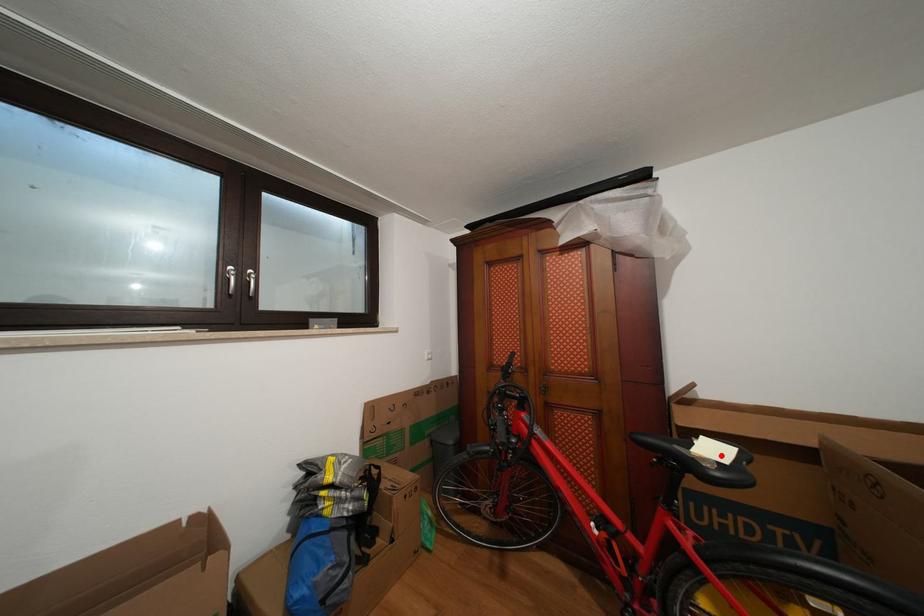
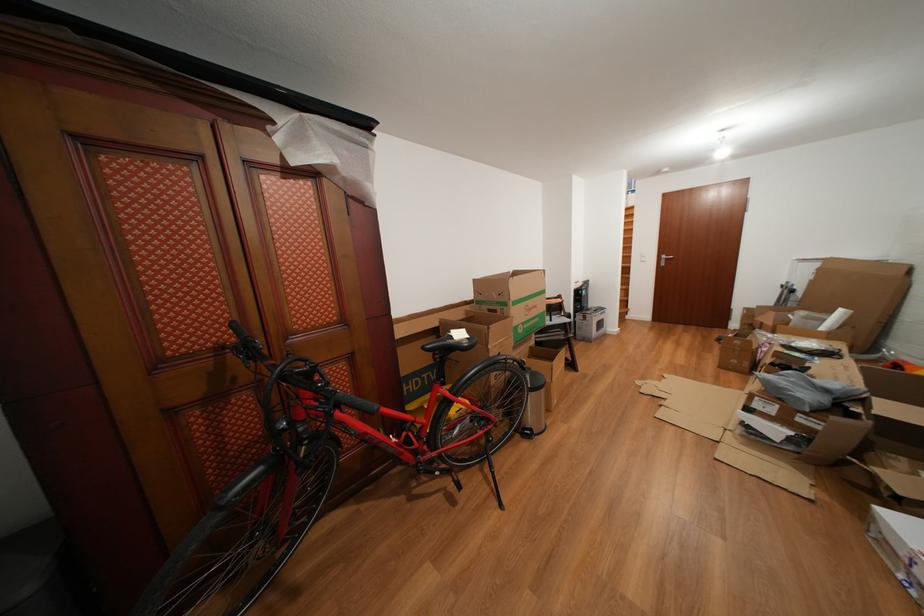
Where in the second image is the point corresponding to the highlighted location from the first image?

(468, 339)